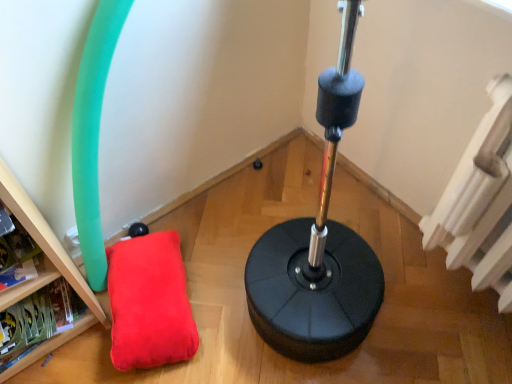
Question: Is white textured radiator at upper right wider or thinner than wooden bookshelf at lower left?

Choices:
 (A) thin
 (B) wide

Answer: (A)

Question: Would you say white textured radiator at upper right is inside or outside wooden bookshelf at lower left?

Choices:
 (A) inside
 (B) outside

Answer: (B)

Question: Based on their relative distances, which object is nearer to the white textured radiator at upper right?

Choices:
 (A) velvet red pillow at lower left
 (B) wooden bookshelf at lower left

Answer: (A)

Question: Estimate the real-world distances between objects in this image. Which object is farther from the wooden bookshelf at lower left?

Choices:
 (A) white textured radiator at upper right
 (B) velvet red pillow at lower left

Answer: (A)